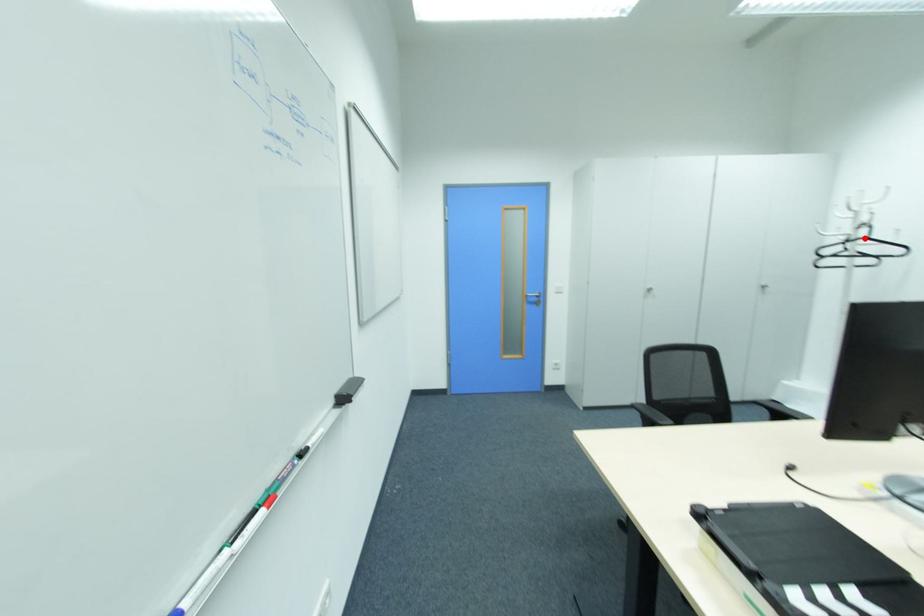
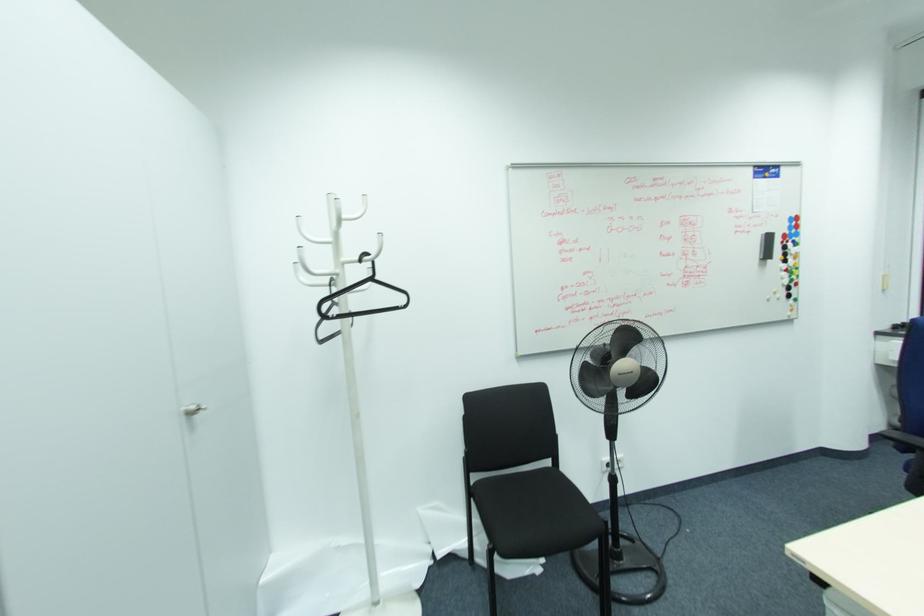
Question: I am providing you with two images of the same scene from different viewpoints. A red point is marked on the first image. Is the red point's position out of view in image 2?

Choices:
 (A) Yes
 (B) No

Answer: (B)